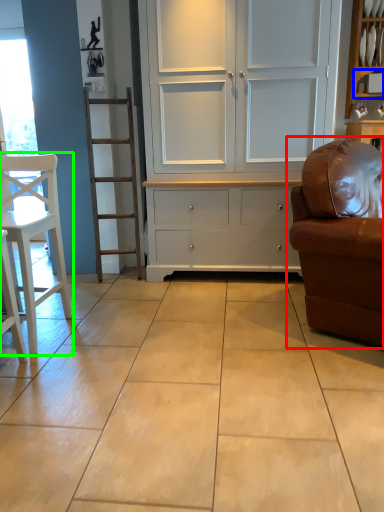
Question: Which object is positioned closest to studio couch (highlighted by a red box)? Select from shelf (highlighted by a blue box) and chair (highlighted by a green box).

Choices:
 (A) shelf
 (B) chair

Answer: (B)